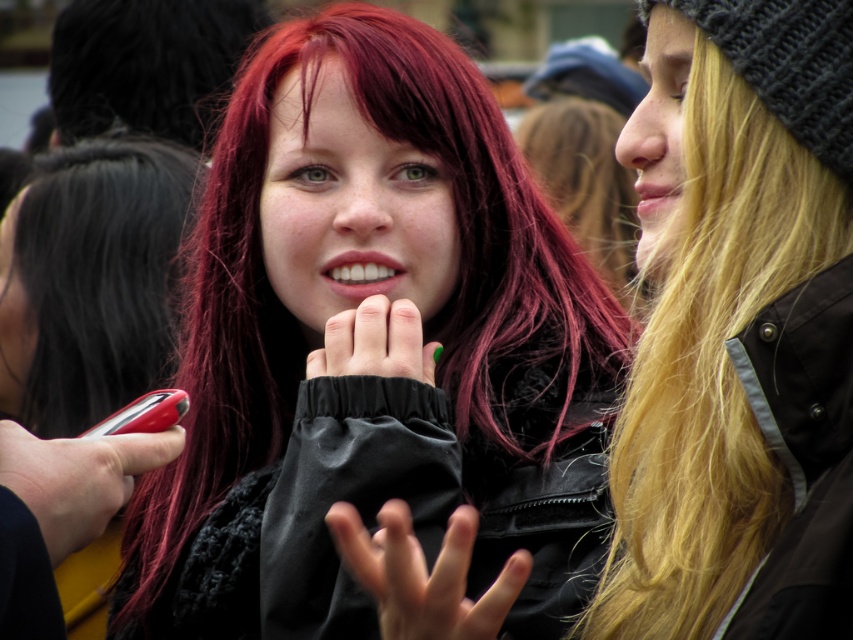
Question: Which object appears closest to the camera in this image?

Choices:
 (A) shiny black hair at upper left
 (B) rubberized red phone at lower left

Answer: (B)

Question: Is dark red silky hair at center below smooth black hand at center?

Choices:
 (A) yes
 (B) no

Answer: (B)

Question: Does blonde hair at right appear on the left side of shiny red phone at lower left?

Choices:
 (A) yes
 (B) no

Answer: (B)

Question: Which point is farther to the camera?

Choices:
 (A) smooth black hand at center
 (B) blonde hair at right
 (C) shiny black hair at upper left

Answer: (C)

Question: Based on their relative distances, which object is nearer to the shiny red phone at lower left?

Choices:
 (A) blonde hair at right
 (B) smooth black hand at center
 (C) green matte nails at center

Answer: (C)

Question: Where is shiny black hair at upper left located in relation to green matte nails at center in the image?

Choices:
 (A) below
 (B) above

Answer: (B)